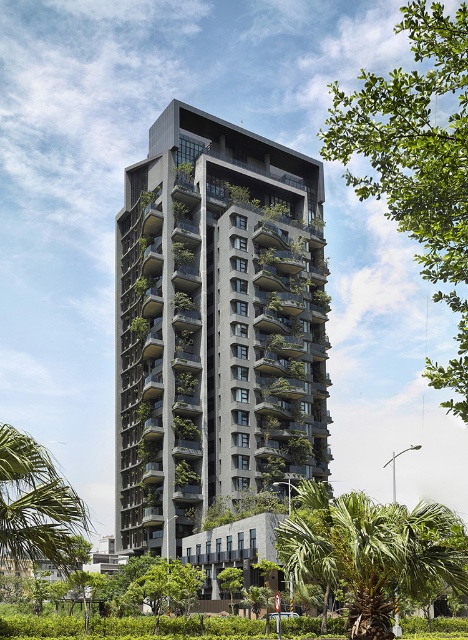
Question: Does dark gray concrete building at center have a lesser width compared to green leafy tree at upper right?

Choices:
 (A) no
 (B) yes

Answer: (B)

Question: Among these points, which one is farthest from the camera?

Choices:
 (A) (85, 515)
 (B) (430, 56)
 (C) (355, 584)

Answer: (B)

Question: Which point is closer to the camera?

Choices:
 (A) (387, 172)
 (B) (267, 253)

Answer: (A)

Question: Which point is closer to the camera?

Choices:
 (A) (328, 547)
 (B) (49, 531)

Answer: (B)

Question: Can you confirm if dark gray concrete building at center is positioned above green leafy palm tree at lower right?

Choices:
 (A) yes
 (B) no

Answer: (A)

Question: Is dark gray concrete building at center below green leafy palm tree at lower right?

Choices:
 (A) yes
 (B) no

Answer: (B)